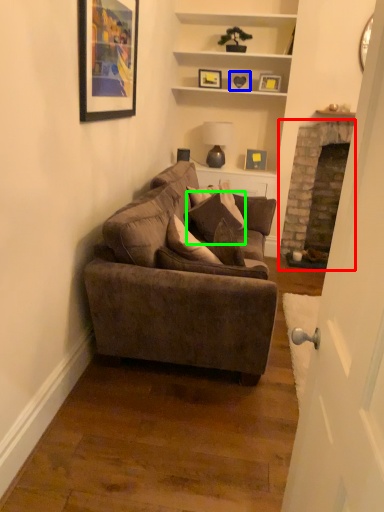
Question: Which object is positioned closest to fireplace (highlighted by a red box)? Select from picture frame (highlighted by a blue box) and pillow (highlighted by a green box).

Choices:
 (A) picture frame
 (B) pillow

Answer: (A)